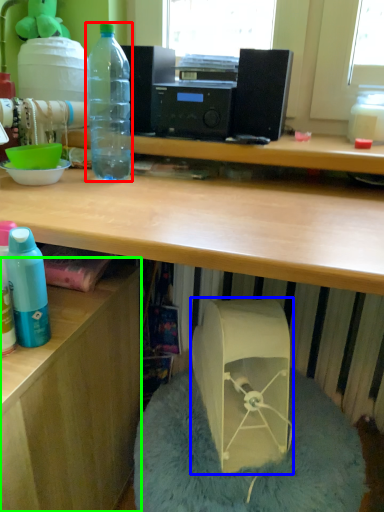
Question: Which object is positioned closest to bottle (highlighted by a red box)? Select from wide (highlighted by a blue box) and desk (highlighted by a green box).

Choices:
 (A) wide
 (B) desk

Answer: (B)